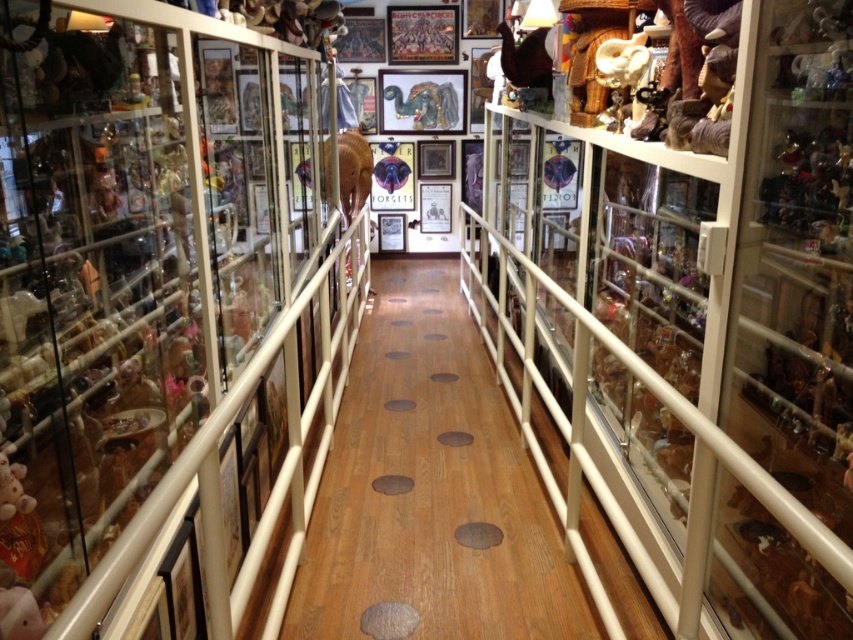
At what (x,y) coordinates should I click in order to perform the action: click on clear glass shelves at center. Please return your answer as a coordinate pair (x, y). This screenshot has width=853, height=640. Looking at the image, I should click on (129, 260).

Does point (196, 337) lie behind point (354, 209)?

No, it is in front of (354, 209).

The image size is (853, 640). Identify the location of clear glass shelves at center. (129, 260).